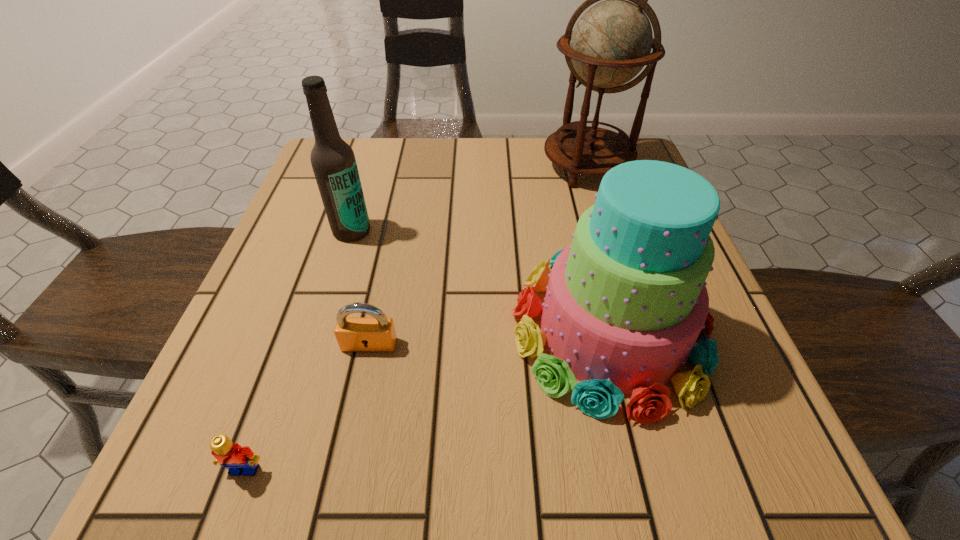
The image size is (960, 540). I want to click on object situated at the far edge, so click(611, 43).

Find the location of a particular element. The height and width of the screenshot is (540, 960). cake present at the near edge is located at coordinates (625, 303).

The width and height of the screenshot is (960, 540). I want to click on Lego present at the near edge, so click(x=238, y=460).

At what (x,y) coordinates should I click in order to perform the action: click on beer bottle positioned at the left edge. Please return your answer as a coordinate pair (x, y). This screenshot has width=960, height=540. Looking at the image, I should click on (333, 161).

Identify the location of Lego present at the left edge. (238, 460).

Identify the location of globe that is at the right edge. (611, 43).

Image resolution: width=960 pixels, height=540 pixels. What are the coordinates of `cake that is at the right edge` in the screenshot? It's located at (625, 303).

Find the location of a particular element. The height and width of the screenshot is (540, 960). object that is positioned at the near left corner is located at coordinates (238, 460).

The width and height of the screenshot is (960, 540). In order to click on object at the far right corner in this screenshot , I will do click(x=611, y=43).

You are a GUI agent. You are given a task and a screenshot of the screen. Output one action in this format:
    pyautogui.click(x=<x>, y=<y>)
    Task: Click on the object that is at the near right corner
    
    Given the screenshot: What is the action you would take?
    pyautogui.click(x=625, y=303)